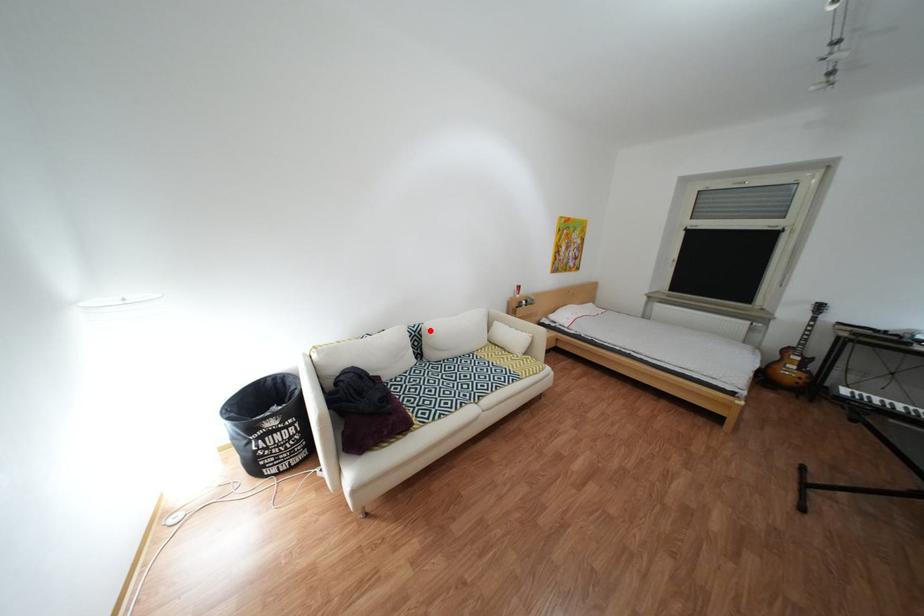
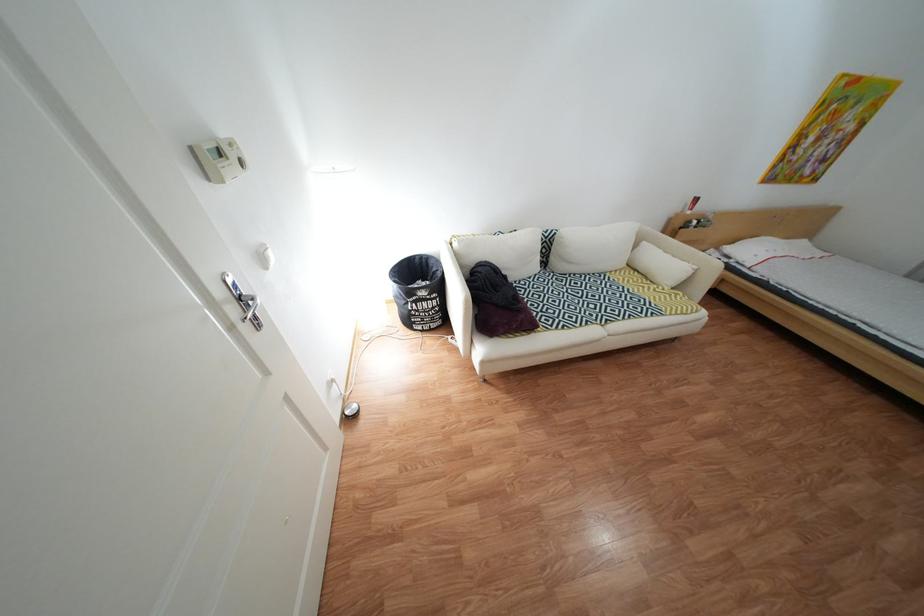
Locate, in the second image, the point that corresponds to the highlighted location in the first image.

(562, 236)